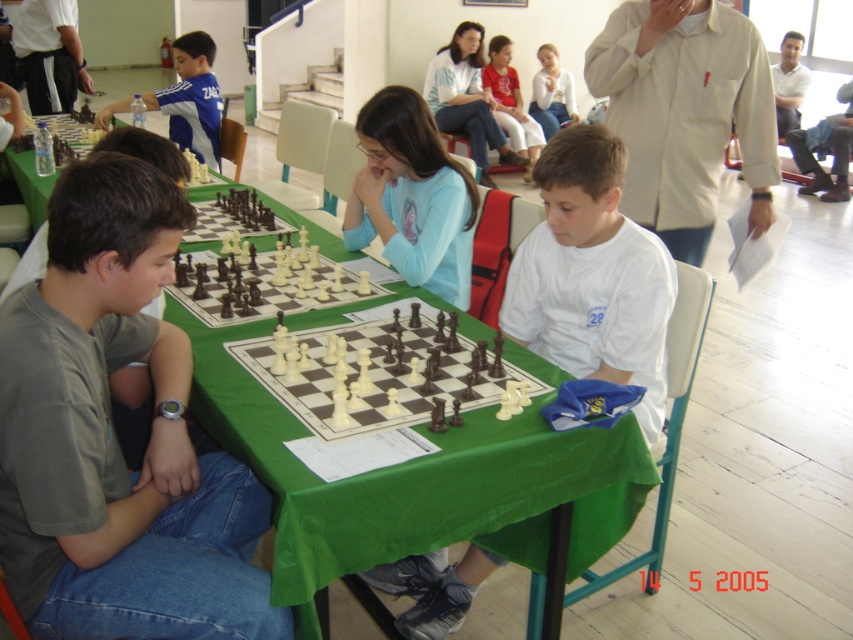
Is blue jersey at center to the right of light blue sweater at upper center from the viewer's perspective?

In fact, blue jersey at center is to the left of light blue sweater at upper center.

Who is more forward, (167, 138) or (541, 96)?

Point (167, 138) is in front.

Does point (212, 108) come closer to viewer compared to point (573, 106)?

Yes, it is in front of point (573, 106).

Identify the location of blue jersey at center. (192, 99).

Can you confirm if white matte shirt at center is positioned to the left of blue jersey at center?

Incorrect, white matte shirt at center is not on the left side of blue jersey at center.

In the scene shown: Can you confirm if white matte shirt at center is thinner than blue jersey at center?

Yes.

Image resolution: width=853 pixels, height=640 pixels. Find the location of `white matte shirt at center`. white matte shirt at center is located at coordinates (592, 275).

Can you confirm if green fabric table at center is thinner than matte pink shirt at center?

No, green fabric table at center is not thinner than matte pink shirt at center.

Find the location of a particular element. Image resolution: width=853 pixels, height=640 pixels. green fabric table at center is located at coordinates (416, 481).